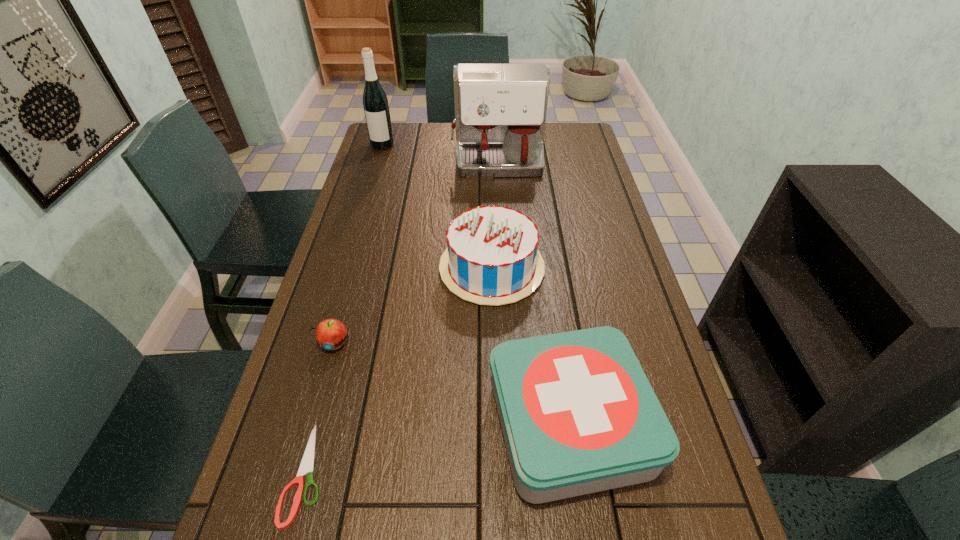
The width and height of the screenshot is (960, 540). In order to click on free space between the fourth tallest object and the second shortest object in this screenshot , I will do `click(451, 383)`.

Identify the location of vacant region between the wine bottle and the apple. (358, 244).

The image size is (960, 540). In order to click on free space between the apple and the third farthest object in this screenshot , I will do `click(413, 305)`.

At what (x,y) coordinates should I click in order to perform the action: click on free point between the third shortest object and the shortest object. Please return your answer as a coordinate pair (x, y). Image resolution: width=960 pixels, height=540 pixels. Looking at the image, I should click on (438, 449).

You are a GUI agent. You are given a task and a screenshot of the screen. Output one action in this format:
    pyautogui.click(x=<x>, y=<y>)
    Task: Click on the free space between the third nearest object and the third tallest object
    This screenshot has height=540, width=960.
    Given the screenshot: What is the action you would take?
    pyautogui.click(x=413, y=305)

Point out which object is positioned as the fourth nearest to the birthday cake. Please provide its 2D coordinates. Your answer should be formatted as a tuple, i.e. [(x, y)], where the tuple contains the x and y coordinates of a point satisfying the conditions above.

[(307, 464)]

Point out which object is positioned as the fifth nearest to the wine bottle. Please provide its 2D coordinates. Your answer should be formatted as a tuple, i.e. [(x, y)], where the tuple contains the x and y coordinates of a point satisfying the conditions above.

[(307, 464)]

At what (x,y) coordinates should I click in order to perform the action: click on free spot that satisfies the following two spatial constraints: 1. on the front of the first-aid kit near the spout; 2. on the left side of the coffee maker. Please return your answer as a coordinate pair (x, y). The height and width of the screenshot is (540, 960). Looking at the image, I should click on (x=512, y=424).

You are a GUI agent. You are given a task and a screenshot of the screen. Output one action in this format:
    pyautogui.click(x=<x>, y=<y>)
    Task: Click on the free space that satisfies the following two spatial constraints: 1. on the label of the wine bottle; 2. on the left side of the fourth shortest object
    
    Given the screenshot: What is the action you would take?
    pyautogui.click(x=346, y=268)

Image resolution: width=960 pixels, height=540 pixels. What are the coordinates of `vacant point that satisfies the following two spatial constraints: 1. on the label of the wine bottle; 2. on the right side of the shortest object` in the screenshot? It's located at (284, 473).